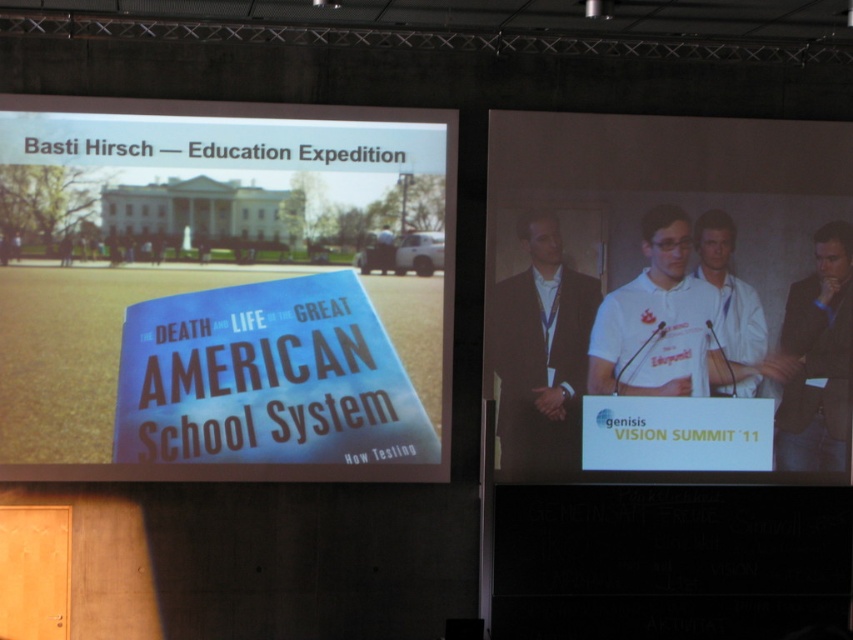
Looking at this image, you are a photographer at the conference. You need to capture a photo of both the dark brown suit at center and the black leather jacket at right. Based on their positions, which one should you focus on first to ensure both are in frame?

The dark brown suit at center is positioned on the left side of black leather jacket at right, so you should focus on the black leather jacket at right first to ensure both are in frame.